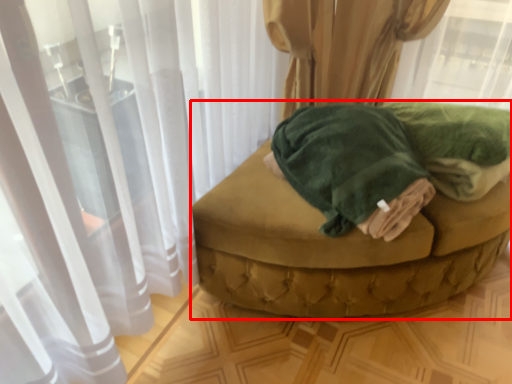
Question: From the image's perspective, what is the correct spatial positioning of furniture (annotated by the red box) in reference to bath towel?

Choices:
 (A) above
 (B) below

Answer: (B)